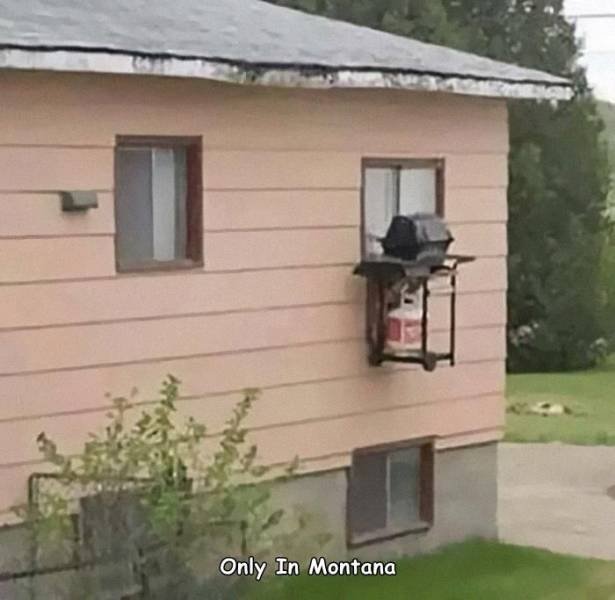
You are a GUI agent. You are given a task and a screenshot of the screen. Output one action in this format:
    pyautogui.click(x=<x>, y=<y>)
    Task: Click on the window
    The image size is (615, 600).
    Given the screenshot: What is the action you would take?
    pyautogui.click(x=145, y=190), pyautogui.click(x=382, y=492), pyautogui.click(x=393, y=198)